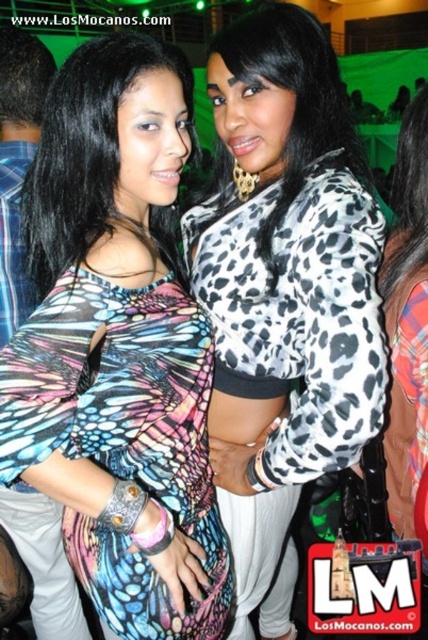
Question: Among these objects, which one is farthest from the camera?

Choices:
 (A) multicolored printed dress at center
 (B) leopard print jacket at center

Answer: (B)

Question: Does multicolored printed dress at center appear under leopard print jacket at center?

Choices:
 (A) yes
 (B) no

Answer: (B)

Question: Is multicolored printed dress at center above leopard print jacket at center?

Choices:
 (A) no
 (B) yes

Answer: (B)

Question: Which point appears farthest from the camera in this image?

Choices:
 (A) (377, 301)
 (B) (211, 508)

Answer: (B)

Question: Does multicolored printed dress at center appear on the right side of leopard print jacket at center?

Choices:
 (A) yes
 (B) no

Answer: (B)